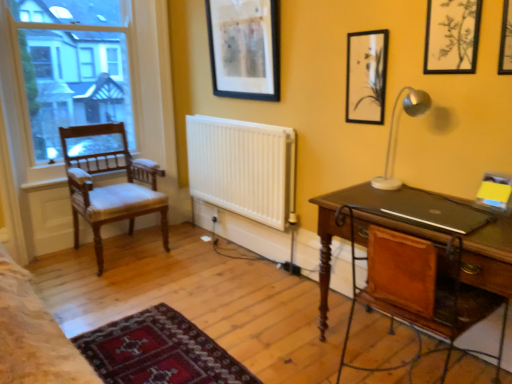
Question: Does clear glass window at left come behind wooden desk at right?

Choices:
 (A) no
 (B) yes

Answer: (B)

Question: Is clear glass window at left at the left side of wooden desk at right?

Choices:
 (A) yes
 (B) no

Answer: (A)

Question: Can you see clear glass window at left touching wooden desk at right?

Choices:
 (A) yes
 (B) no

Answer: (B)

Question: From the image's perspective, is clear glass window at left located beneath wooden desk at right?

Choices:
 (A) no
 (B) yes

Answer: (A)

Question: From a real-world perspective, is clear glass window at left on top of wooden desk at right?

Choices:
 (A) no
 (B) yes

Answer: (B)

Question: Is clear glass window at left to the right of wooden desk at right from the viewer's perspective?

Choices:
 (A) no
 (B) yes

Answer: (A)

Question: Does matte black picture frame at upper center, the first picture frame when ordered from left to right, have a larger size compared to wooden desk at right?

Choices:
 (A) yes
 (B) no

Answer: (B)

Question: Can you confirm if matte black picture frame at upper center, the 4th picture frame viewed from the right, is thinner than wooden desk at right?

Choices:
 (A) no
 (B) yes

Answer: (B)

Question: Is matte black picture frame at upper center, the 4th picture frame viewed from the right, touching wooden desk at right?

Choices:
 (A) yes
 (B) no

Answer: (B)

Question: From a real-world perspective, is matte black picture frame at upper center, the first picture frame when ordered from left to right, below wooden desk at right?

Choices:
 (A) yes
 (B) no

Answer: (B)

Question: From a real-world perspective, is matte black picture frame at upper center, the 4th picture frame viewed from the right, positioned over wooden desk at right based on gravity?

Choices:
 (A) no
 (B) yes

Answer: (B)

Question: Is matte black picture frame at upper center, placed as the first picture frame when sorted from back to front, aimed at wooden desk at right?

Choices:
 (A) yes
 (B) no

Answer: (B)

Question: Is clear glass window at left positioned before white matte radiator at center?

Choices:
 (A) no
 (B) yes

Answer: (A)